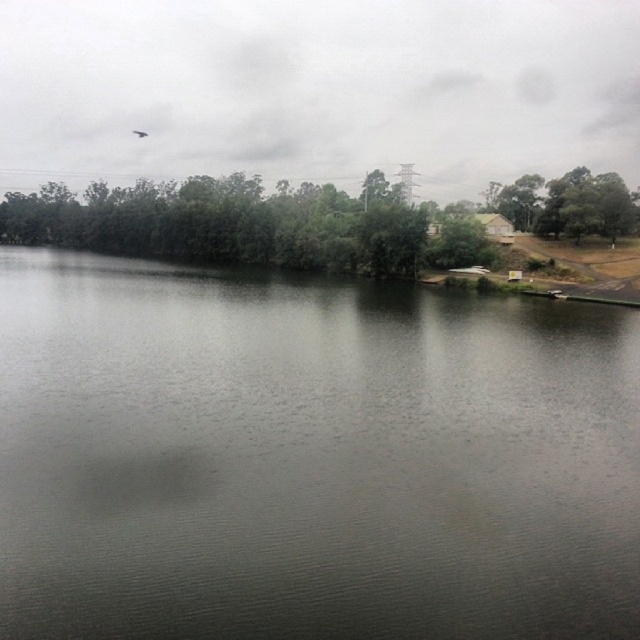
Measure the distance between point [634,582] and camera.

The distance of point [634,582] from camera is 11.74 meters.

Who is shorter, dark gray water at center or green matte tree at upper right?

Standing shorter between the two is dark gray water at center.

Is point (161, 275) positioned behind point (529, 180)?

No, it is in front of (529, 180).

Locate an element on the screen. This screenshot has width=640, height=640. dark gray water at center is located at coordinates (308, 458).

Does dark gray water at center have a greater height compared to green leafy trees at center?

In fact, dark gray water at center may be shorter than green leafy trees at center.

This screenshot has height=640, width=640. What do you see at coordinates (308, 458) in the screenshot? I see `dark gray water at center` at bounding box center [308, 458].

Is point (611, 452) in front of point (179, 208)?

Yes.

The image size is (640, 640). Find the location of `dark gray water at center`. dark gray water at center is located at coordinates (308, 458).

Which of these two, green leafy trees at center or green matte tree at upper right, stands taller?

Standing taller between the two is green leafy trees at center.

Who is more forward, (56, 195) or (625, 188)?

Positioned in front is point (625, 188).

Who is more distant from viewer, (340, 198) or (612, 176)?

The point (340, 198) is behind.

You are a GUI agent. You are given a task and a screenshot of the screen. Output one action in this format:
    pyautogui.click(x=<x>, y=<y>)
    Task: Click on the green leafy trees at center
    This screenshot has height=640, width=640.
    Given the screenshot: What is the action you would take?
    pyautogui.click(x=244, y=225)